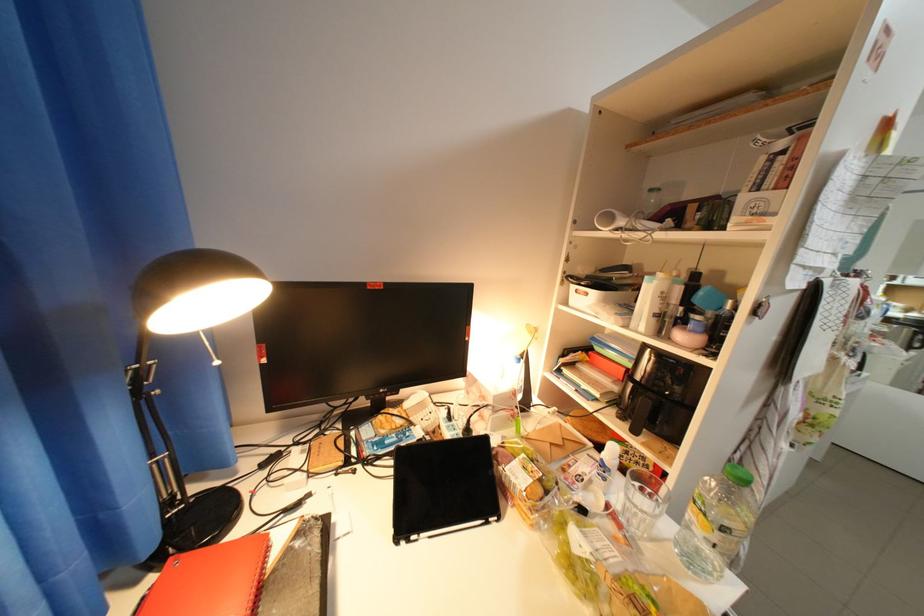
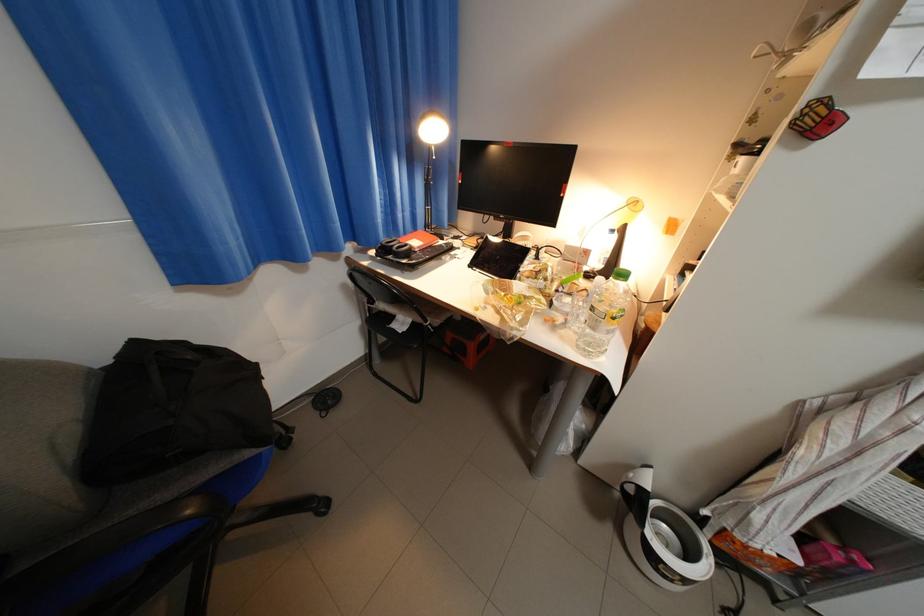
The images are taken continuously from a first-person perspective. In which direction is your viewpoint rotating?

The camera's rotation is toward left-down.